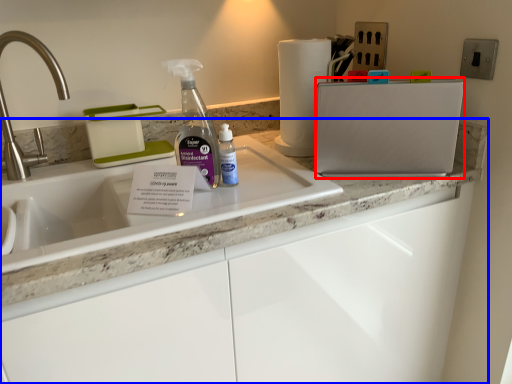
Question: Which point is closer to the camera, appliance (highlighted by a red box) or countertop (highlighted by a blue box)?

Choices:
 (A) appliance
 (B) countertop

Answer: (B)